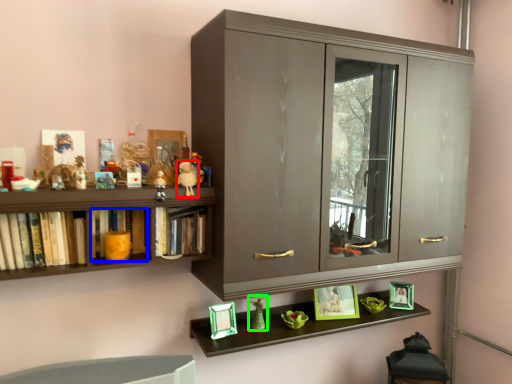
Question: Considering the real-world distances, which object is farthest from toy (highlighted by a red box)? book (highlighted by a blue box) or toy (highlighted by a green box)?

Choices:
 (A) book
 (B) toy

Answer: (B)